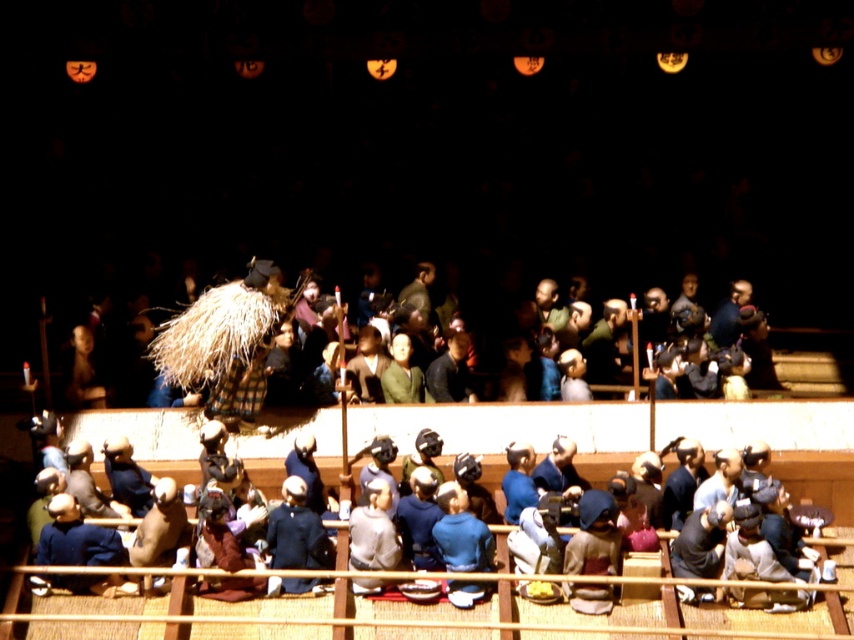
Looking at this image, you are a stagehand in the kabuki theater. You need to hang a decorative banner that requires 2 meters of height. You see the dark blue fabric at lower right and the green fabric kimono at center. Which object has sufficient height for the banner?

The dark blue fabric at lower right is much taller than the green fabric kimono at center, so it has sufficient height for the banner.

You are a stagehand in a kabuki theater and need to place a decorative lantern at the exact center of the stage. The stage has a coordinate system where the bottom left corner is at point 0,0 and the top right corner is at point 1,1. You see the blue fabric kimono at lower right at point 0.755,0.800. Where should you place the lantern to ensure it is centered?

The exact center of the stage would be at point (427, 320). Since the blue fabric kimono at lower right is at (682, 483), the lantern should be placed at the center coordinates (427, 320) to ensure it is centered on the stage.

You are a stagehand preparing to move the blue fabric kimono at lower right and the dark brown leather jacket at center. Which object is closer to the audience sitting in front of the stage?

The blue fabric kimono at lower right is closer to the audience because it is in front of the dark brown leather jacket at center.